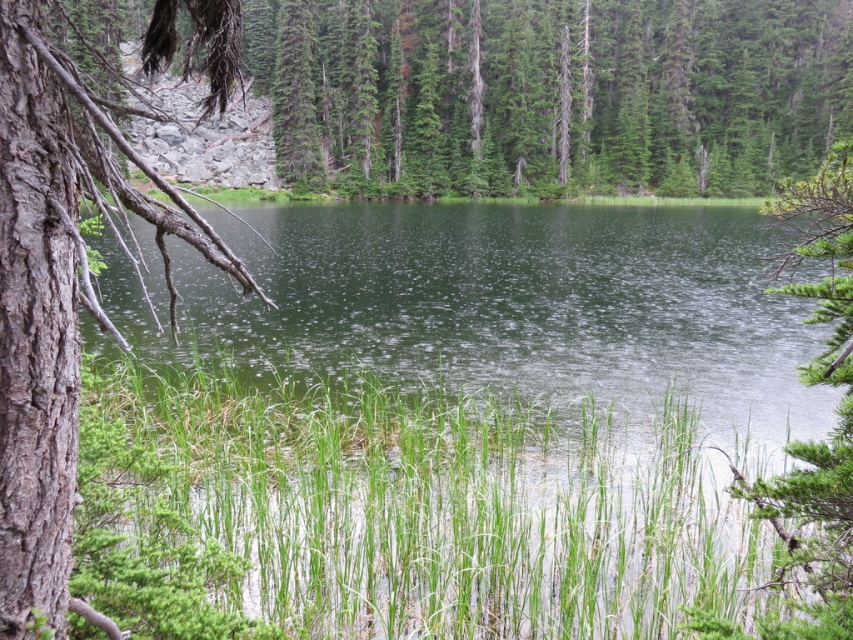
Question: Does green textured tree at upper center have a smaller size compared to smooth bark tree at left?

Choices:
 (A) no
 (B) yes

Answer: (A)

Question: Is green textured tree at upper center wider than smooth bark tree at left?

Choices:
 (A) no
 (B) yes

Answer: (B)

Question: Can you confirm if green textured tree at upper center is positioned to the right of smooth bark tree at left?

Choices:
 (A) no
 (B) yes

Answer: (B)

Question: Among these objects, which one is farthest from the camera?

Choices:
 (A) green textured tree at upper center
 (B) smooth bark tree at left

Answer: (A)

Question: Which point is farther to the camera?

Choices:
 (A) (132, 157)
 (B) (379, 86)

Answer: (B)